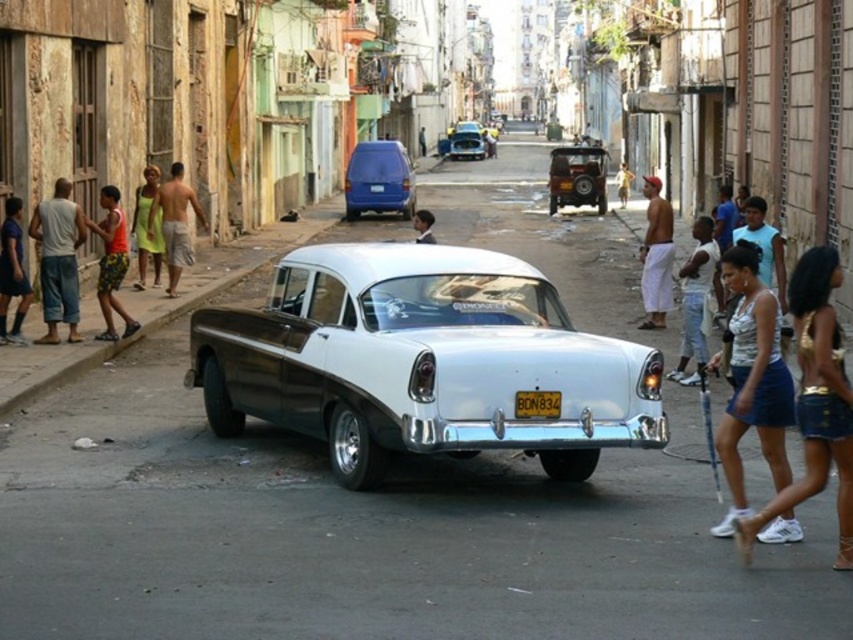
You are a tourist standing on the street and want to take a photo of the yellow matte license plate at center. There is a tan skin shirtless man at left blocking your view. Can you move to your right to get a clear shot of the license plate?

The tan skin shirtless man at left is to the left of the yellow matte license plate at center, so moving to your right should allow you to avoid the man and capture the license plate in your photo.

You are a photographer standing on the street. You want to take a photo of the white glossy car at center and the green dress at left. Which object is shorter?

The white glossy car at center is not as tall as the green dress at left, so the car is shorter than the dress.

You are a photographer standing on the street and want to take a photo of the shiny blue car at center. However, there are white cotton shorts at right blocking your view. Can you determine which object is taller so you can decide if you need to move the obstruction?

A: The white cotton shorts at right has a greater height compared to the shiny blue car at center. Therefore, you need to move the white cotton shorts at right to get an unobstructed view of the shiny blue car at center.